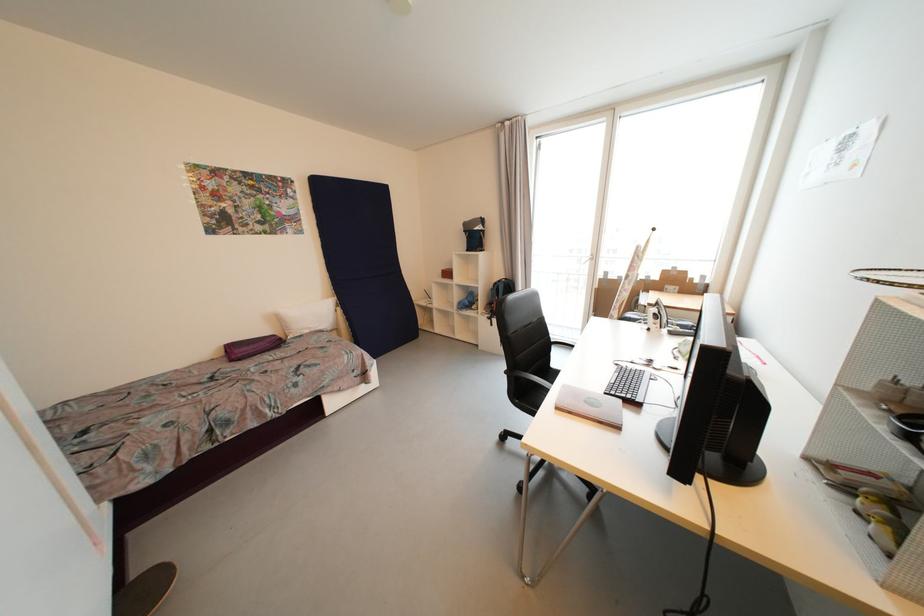
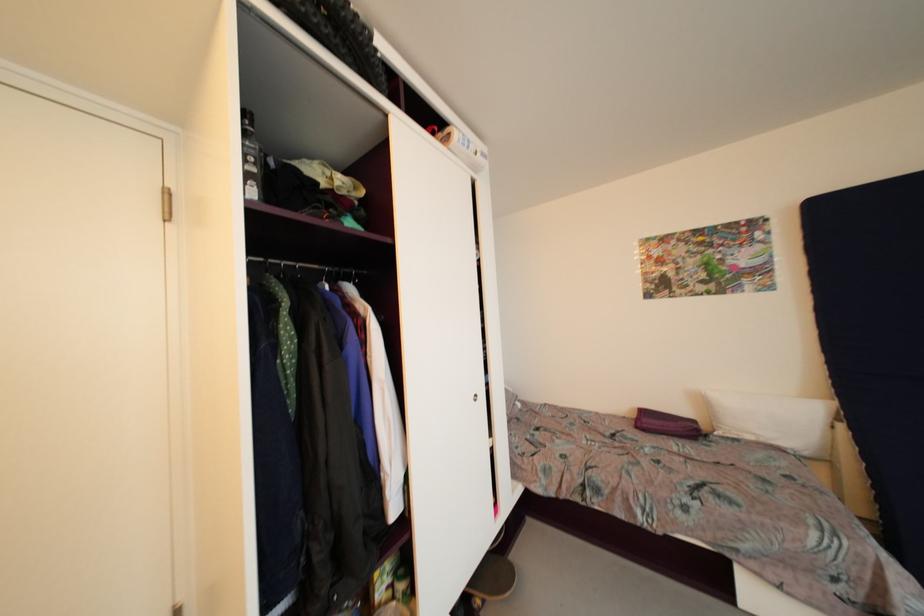
Question: The camera is either moving clockwise (left) or counter-clockwise (right) around the object. The first image is from the beginning of the video and the second image is from the end. Is the camera moving left or right when shooting the video?

Choices:
 (A) Left
 (B) Right

Answer: (B)